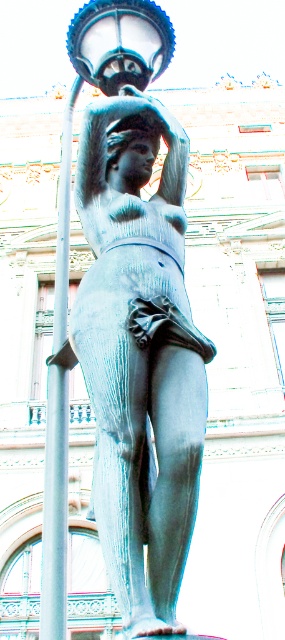
You are standing in front of the building and see the bronze statue at center and the silver metallic pole at left. Which object is closer to the ground?

The bronze statue at center is located below the silver metallic pole at left, so it is closer to the ground.

In the scene shown: You are standing in front of the statue and the building. You notice two points marked in the image. One is at coordinates point (47, 451) and the other at point (143, 17). Which point is closer to you?

Point (47, 451) is in front of point (143, 17), so the point at (47, 451) is closer to you.

You are standing in front of the statue and want to place a small flower at the base of the statue. The flower needs to be placed closer to the building than to the statue. Which point should you choose between point 1 at coordinates (137, 556) and point 2 at coordinates (45, 451)?

Point 2 at coordinates (45, 451) is closer to the building than point 1 at coordinates (137, 556). Therefore, you should choose point 2 at coordinates (45, 451) to place the flower closer to the building.